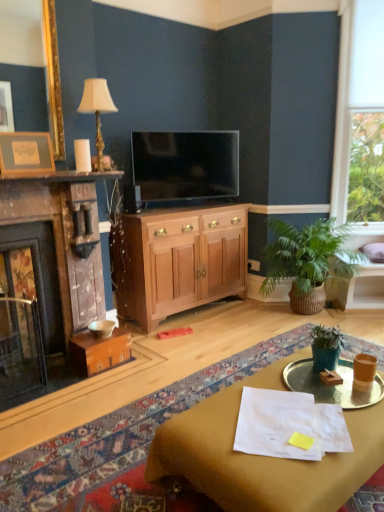
Question: From the image's perspective, is matte black tv at center located beneath green woven basket at right, which is the second houseplant in front-to-back order?

Choices:
 (A) yes
 (B) no

Answer: (B)

Question: From a real-world perspective, is matte black tv at center below green woven basket at right, which is the second houseplant in front-to-back order?

Choices:
 (A) no
 (B) yes

Answer: (A)

Question: Is matte black tv at center smaller than green woven basket at right, the 1th houseplant positioned from the back?

Choices:
 (A) yes
 (B) no

Answer: (A)

Question: Can we say matte black tv at center lies outside green woven basket at right, the 1th houseplant positioned from the back?

Choices:
 (A) no
 (B) yes

Answer: (B)

Question: Is matte black tv at center facing towards green woven basket at right, which is the second houseplant in front-to-back order?

Choices:
 (A) yes
 (B) no

Answer: (B)

Question: From a real-world perspective, is translucent glass tray at center positioned above or below matte black tv at center?

Choices:
 (A) below
 (B) above

Answer: (A)

Question: Based on their positions, is translucent glass tray at center located to the left or right of matte black tv at center?

Choices:
 (A) left
 (B) right

Answer: (B)

Question: Relative to matte black tv at center, is translucent glass tray at center in front or behind?

Choices:
 (A) behind
 (B) front

Answer: (B)

Question: Is translucent glass tray at center spatially inside matte black tv at center, or outside of it?

Choices:
 (A) inside
 (B) outside

Answer: (B)

Question: Considering the positions of green matte plant pot at center, which is the first houseplant in front-to-back order, and matte brown desk at lower right in the image, is green matte plant pot at center, which is the first houseplant in front-to-back order, wider or thinner than matte brown desk at lower right?

Choices:
 (A) thin
 (B) wide

Answer: (A)

Question: Is point (317, 337) closer or farther from the camera than point (261, 384)?

Choices:
 (A) farther
 (B) closer

Answer: (A)

Question: Relative to matte brown desk at lower right, is green matte plant pot at center, which is the first houseplant in front-to-back order, in front or behind?

Choices:
 (A) front
 (B) behind

Answer: (B)

Question: From the image's perspective, relative to matte brown desk at lower right, is green matte plant pot at center, which is the first houseplant in front-to-back order, above or below?

Choices:
 (A) above
 (B) below

Answer: (A)

Question: From a real-world perspective, relative to wooden fireplace at left, is matte black tv at center vertically above or below?

Choices:
 (A) below
 (B) above

Answer: (B)

Question: In terms of size, does matte black tv at center appear bigger or smaller than wooden fireplace at left?

Choices:
 (A) big
 (B) small

Answer: (B)